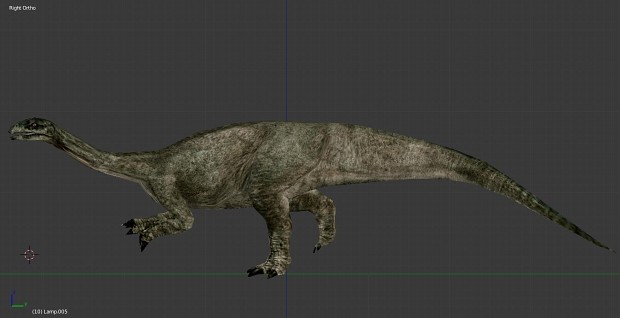
The width and height of the screenshot is (620, 318). What are the coordinates of `right front leg` in the screenshot? It's located at (146, 220).